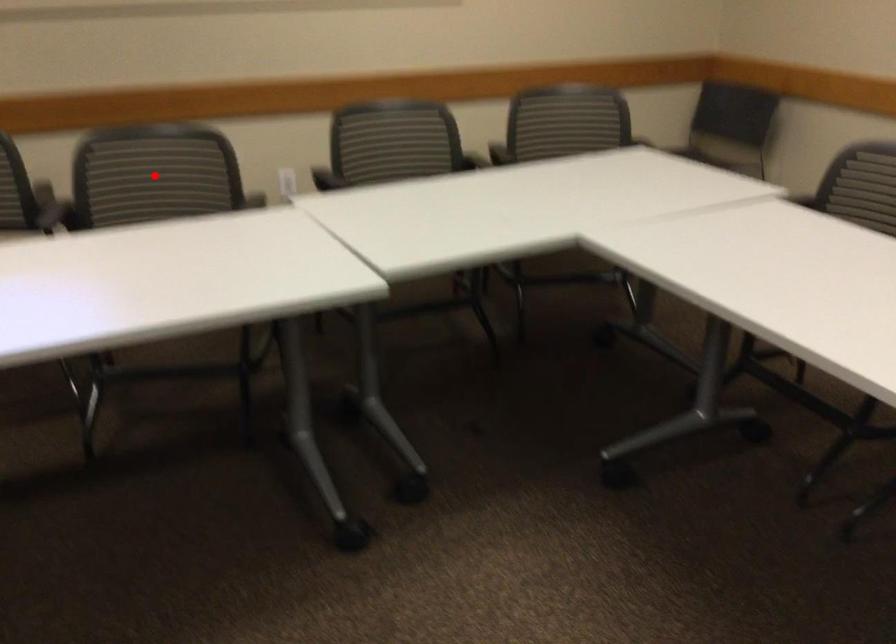
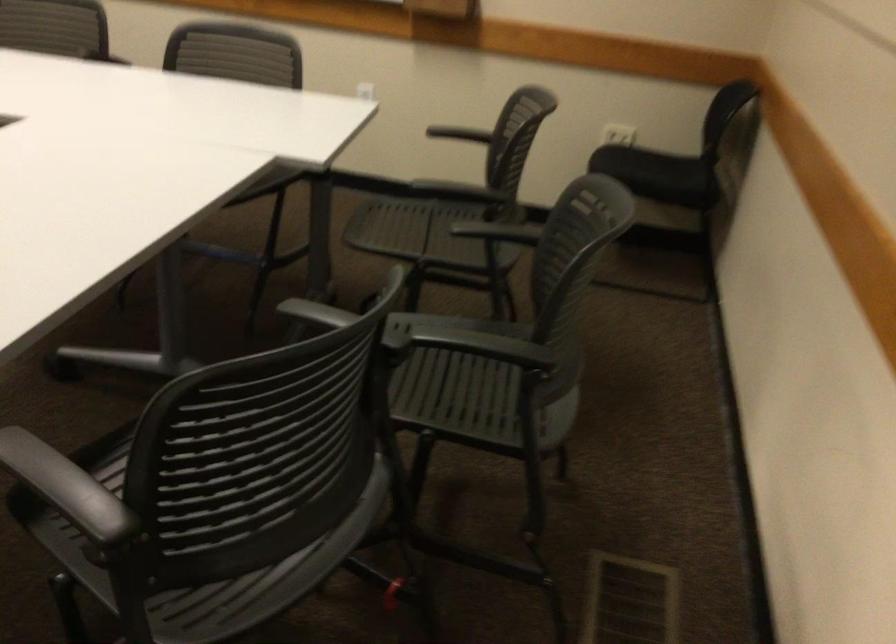
Question: I am providing you with two images of the same scene from different viewpoints. A red point is marked on the first image. Is the red point's position out of view in image 2?

Choices:
 (A) Yes
 (B) No

Answer: (A)